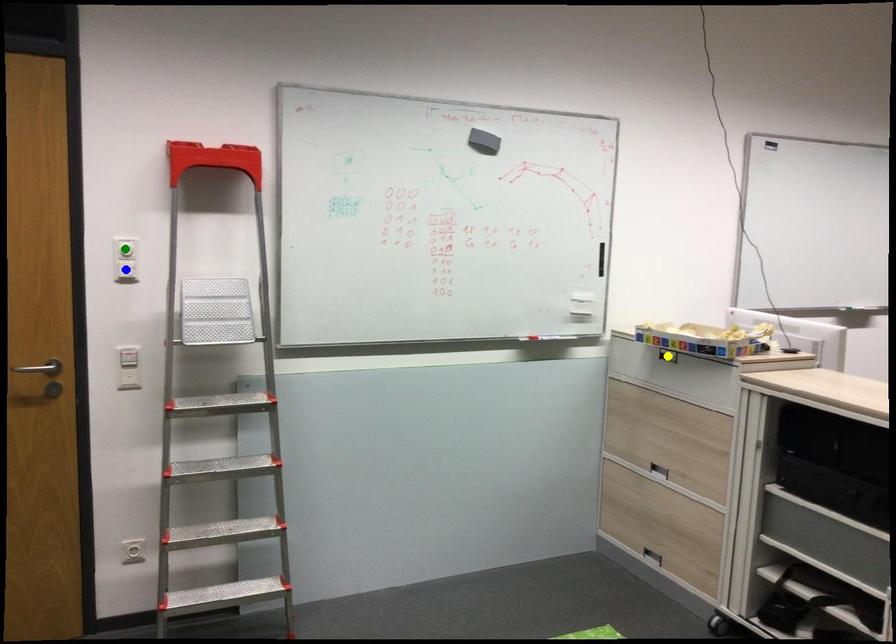
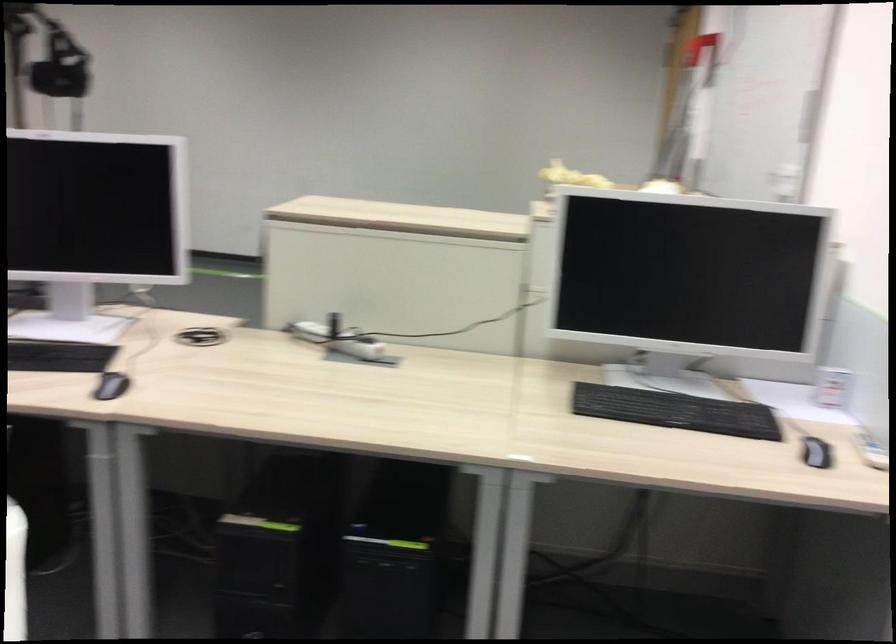
I am providing you with two images of the same scene from different viewpoints. Three points are marked in image1. Which point corresponds to a part or object that is occluded in image2?In image1, three points are marked. Which of them correspond to a part or object that is occluded in image2?Among the three points shown in image1, which one corresponds to a part or object that is no longer visible due to occlusion in image2?

Invisible in image2: blue point, yellow point, green point.